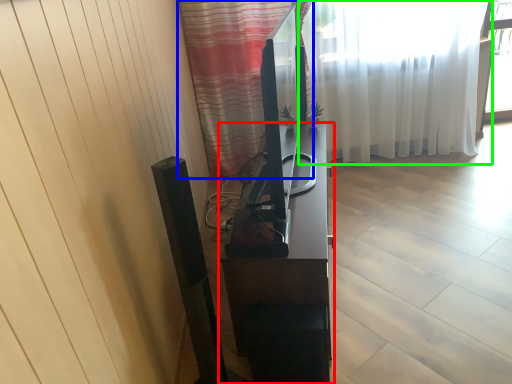
Question: Based on their relative distances, which object is farther from furniture (highlighted by a red box)? Choose from curtain (highlighted by a blue box) and curtain (highlighted by a green box).

Choices:
 (A) curtain
 (B) curtain

Answer: (B)